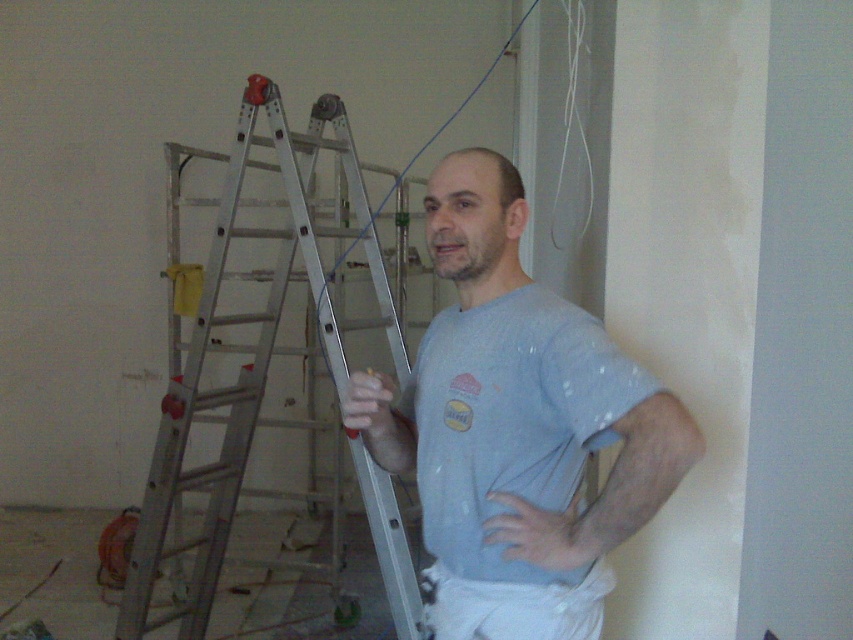
Is silver metallic ladder at left shorter than light blue cotton t-shirt at center?

No.

Which of these two, silver metallic ladder at left or light blue cotton t-shirt at center, stands shorter?

light blue cotton t-shirt at center

Between point (193, 337) and point (456, 426), which one is positioned in front?

Point (456, 426) is more forward.

Find the location of a particular element. silver metallic ladder at left is located at coordinates (241, 342).

Does light blue cotton shirt at center lie behind silver metallic ladder at left?

No.

Which is above, light blue cotton shirt at center or silver metallic ladder at left?

light blue cotton shirt at center

Is point (463, 456) farther from viewer compared to point (241, 401)?

No.

This screenshot has height=640, width=853. In order to click on light blue cotton shirt at center in this screenshot , I will do `click(515, 428)`.

Who is more distant from viewer, (494, 172) or (442, 458)?

The point (494, 172) is more distant.

Can you confirm if light blue cotton shirt at center is thinner than light blue cotton t-shirt at center?

Incorrect, light blue cotton shirt at center's width is not less than light blue cotton t-shirt at center's.

Between point (677, 417) and point (579, 385), which one is positioned behind?

The point (579, 385) is behind.

This screenshot has height=640, width=853. In order to click on light blue cotton shirt at center in this screenshot , I will do `click(515, 428)`.